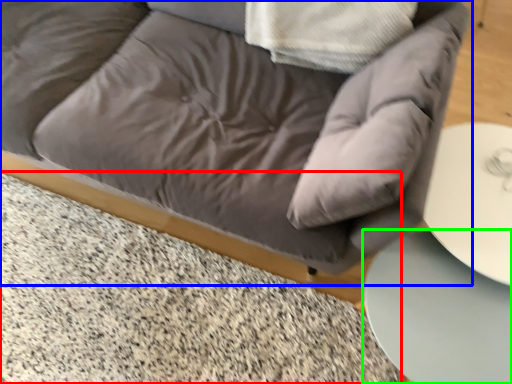
Question: Which object is positioned farthest from marble (highlighted by a red box)? Select from studio couch (highlighted by a blue box) and table (highlighted by a green box).

Choices:
 (A) studio couch
 (B) table

Answer: (B)